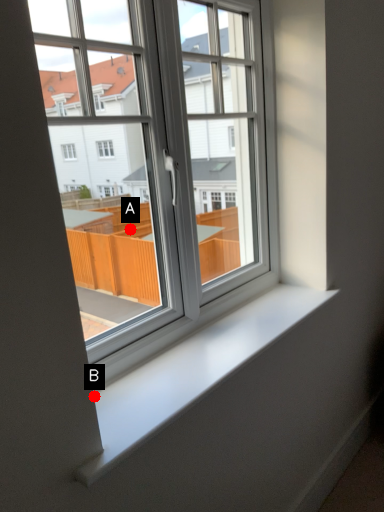
Question: Two points are circled on the image, labeled by A and B beside each circle. Which point is farther to the camera?

Choices:
 (A) A is further
 (B) B is further

Answer: (A)